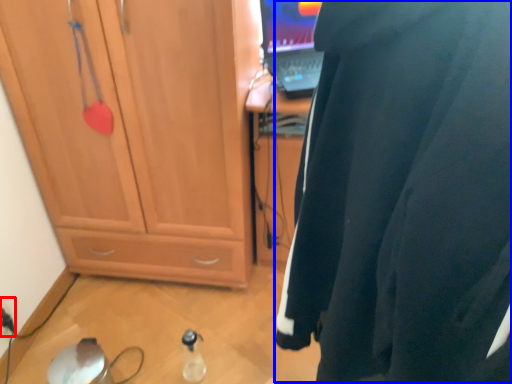
Question: Which object appears farthest to the camera in this image, electric outlet (highlighted by a red box) or wetsuit (highlighted by a blue box)?

Choices:
 (A) electric outlet
 (B) wetsuit

Answer: (A)